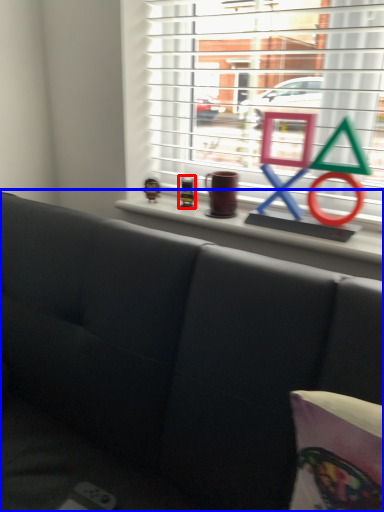
Question: Which object appears closest to the camera in this image, toy (highlighted by a red box) or studio couch (highlighted by a blue box)?

Choices:
 (A) toy
 (B) studio couch

Answer: (B)